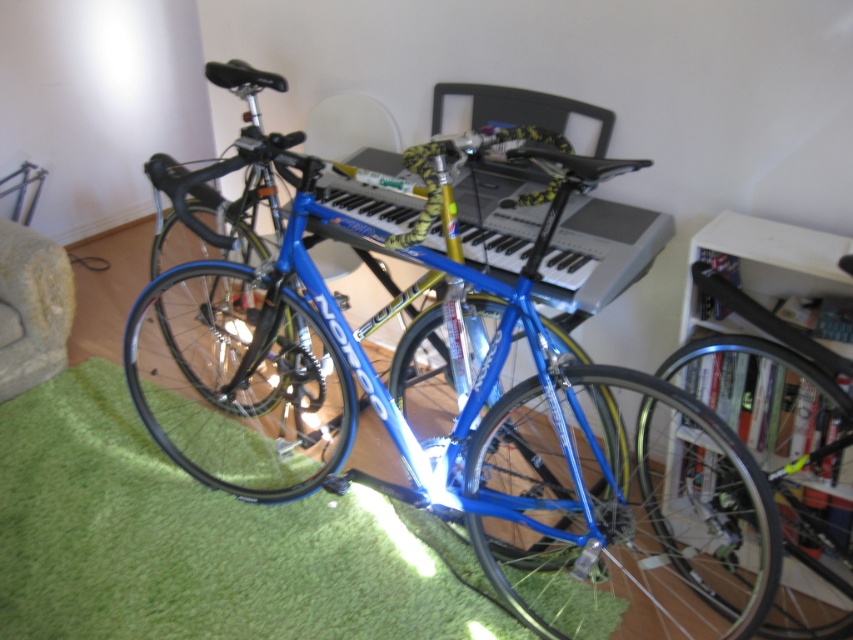
Question: Which point appears closest to the camera in this image?

Choices:
 (A) (347, 188)
 (B) (799, 374)
 (C) (316, 317)

Answer: (B)

Question: Does blue metallic bicycle at center appear on the right side of yellow-green textured piano at center?

Choices:
 (A) yes
 (B) no

Answer: (B)

Question: Does blue metallic bicycle at center have a lesser width compared to yellow-green textured piano at center?

Choices:
 (A) no
 (B) yes

Answer: (A)

Question: Can you confirm if blue metallic bicycle at center is positioned to the right of white cardboard at upper right?

Choices:
 (A) no
 (B) yes

Answer: (A)

Question: Which point is closer to the camera taking this photo?

Choices:
 (A) (798, 401)
 (B) (480, 234)

Answer: (A)

Question: Which object is closer to the camera taking this photo?

Choices:
 (A) yellow-green textured piano at center
 (B) blue metallic bicycle at center

Answer: (B)